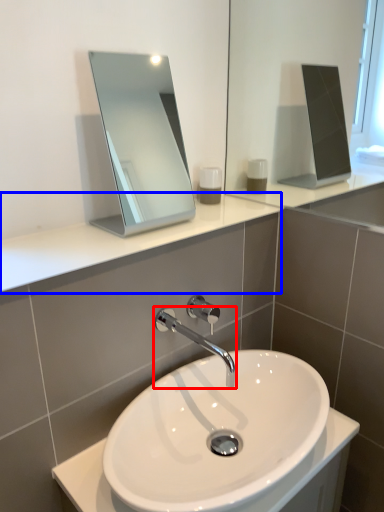
Question: Which object is closer to the camera taking this photo, tap (highlighted by a red box) or counter top (highlighted by a blue box)?

Choices:
 (A) tap
 (B) counter top

Answer: (B)